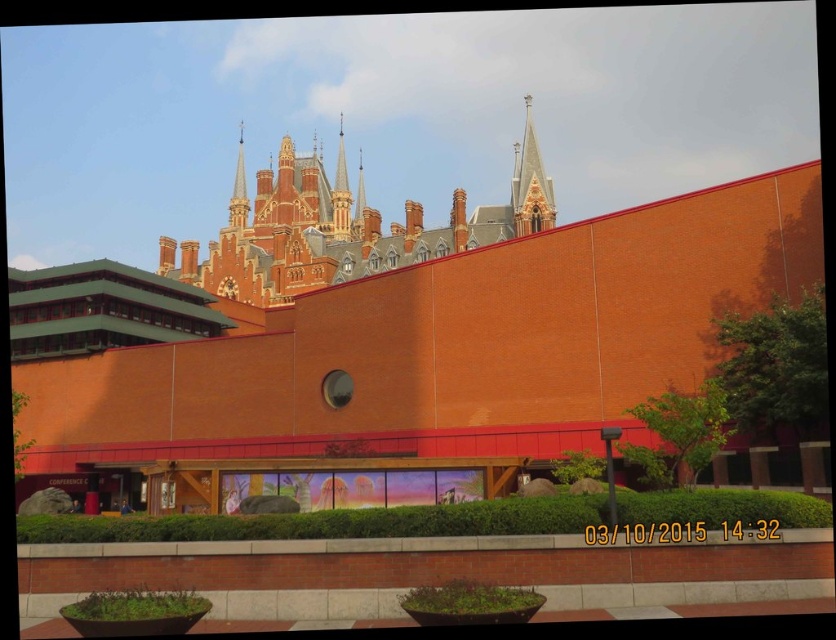
Is red brick spire at upper center wider than smooth stone spire at upper center?

Indeed, red brick spire at upper center has a greater width compared to smooth stone spire at upper center.

Who is more distant from viewer, (347, 189) or (360, 164)?

The point (360, 164) is more distant.

Is point (344, 205) positioned before point (360, 208)?

Yes, point (344, 205) is closer to viewer.

Identify the location of red brick spire at upper center. (340, 193).

Which of these two, brick church at upper center or smooth stone spire at upper center, stands taller?

With more height is brick church at upper center.

Which is in front, point (41, 436) or point (354, 200)?

Point (41, 436)

Locate an element on the screen. brick church at upper center is located at coordinates (391, 330).

Locate an element on the screen. The image size is (836, 640). brick church at upper center is located at coordinates (391, 330).

Is smooth brick spire at upper center positioned at the back of smooth stone spire at upper center?

No, smooth brick spire at upper center is in front of smooth stone spire at upper center.

Is point (238, 122) positioned in front of point (360, 179)?

No.

Describe the element at coordinates (238, 189) in the screenshot. I see `smooth brick spire at upper center` at that location.

This screenshot has height=640, width=836. Find the location of `smooth brick spire at upper center`. smooth brick spire at upper center is located at coordinates (238, 189).